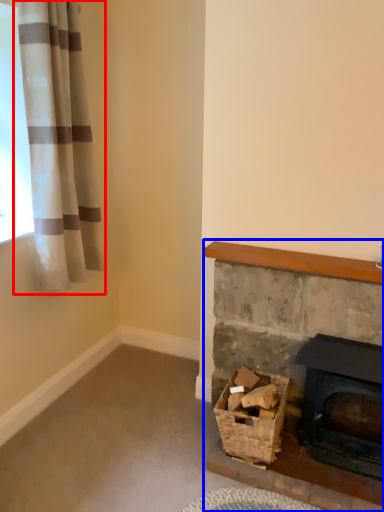
Question: Which object appears farthest to the camera in this image, curtain (highlighted by a red box) or fireplace (highlighted by a blue box)?

Choices:
 (A) curtain
 (B) fireplace

Answer: (B)